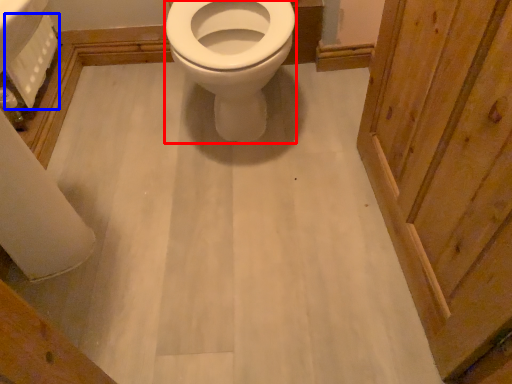
Question: Among these objects, which one is nearest to the camera, bidet (highlighted by a red box) or toilet paper (highlighted by a blue box)?

Choices:
 (A) bidet
 (B) toilet paper

Answer: (A)